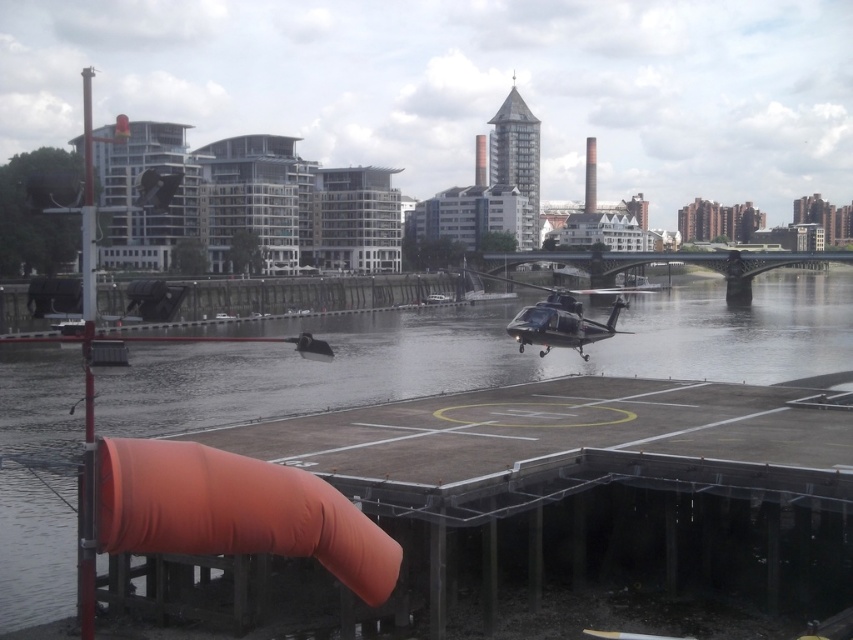
Can you confirm if transparent water at center is positioned above metallic silver helicopter at center?

Indeed, transparent water at center is positioned over metallic silver helicopter at center.

How distant is transparent water at center from metallic silver helicopter at center?

24.37 meters

Which is behind, point (270, 348) or point (566, 312)?

The point (270, 348) is behind.

This screenshot has height=640, width=853. What are the coordinates of `transparent water at center` in the screenshot? It's located at (485, 353).